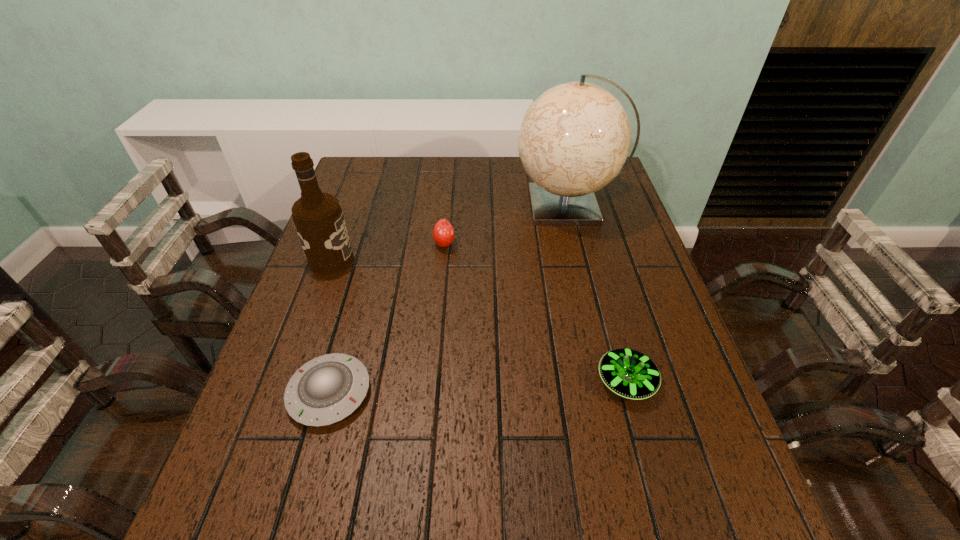
The height and width of the screenshot is (540, 960). I want to click on vacant space located on the surface of the globe showing Europe and Africa, so click(438, 206).

Identify the location of free region located on the label of the fourth shortest object. Image resolution: width=960 pixels, height=540 pixels. (452, 260).

Find the location of a particular element. The width and height of the screenshot is (960, 540). vacant point located 0.270m on the front of the third tallest object is located at coordinates (437, 329).

You are a GUI agent. You are given a task and a screenshot of the screen. Output one action in this format:
    pyautogui.click(x=<x>, y=<y>)
    Task: Click on the free space located 0.380m on the back of the fourth tallest object
    
    Given the screenshot: What is the action you would take?
    pyautogui.click(x=589, y=246)

The width and height of the screenshot is (960, 540). Find the location of `vacant area situated on the back of the shortest object`. vacant area situated on the back of the shortest object is located at coordinates (365, 264).

Find the location of `object located at the far edge`. object located at the far edge is located at coordinates (575, 137).

The image size is (960, 540). I want to click on alcohol located in the left edge section of the desktop, so click(318, 218).

Locate an element on the screen. saucer present at the left edge is located at coordinates (325, 390).

The height and width of the screenshot is (540, 960). I want to click on globe that is at the right edge, so click(x=575, y=137).

The height and width of the screenshot is (540, 960). Identify the location of saucer at the right edge. (629, 373).